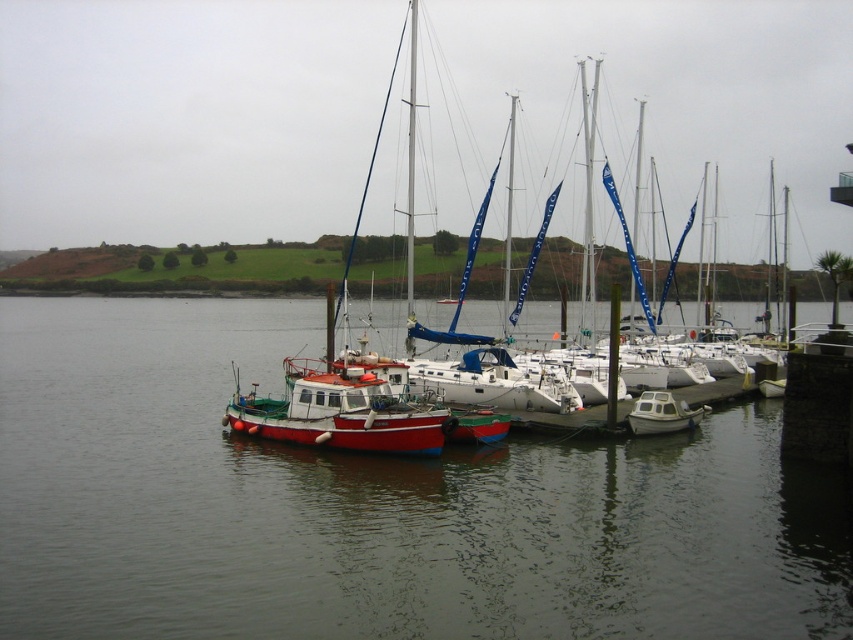
You are a photographer planning to capture a wide shot of the marina. You want to ensure that both the smooth water at center and the red matte fishing boat at center are clearly visible in the frame. Based on their sizes, which object will occupy more of the image area?

The smooth water at center is larger in size than the red matte fishing boat at center, so it will occupy more of the image area.

You are standing at the marina and want to reach a specific point marked at coordinates point (741, 509). If your maximum comfortable walking distance is 15 meters, can you comfortably walk to that point from where you are standing?

The distance of point (741, 509) from camera is 15.75 meters, which exceeds your 15 meter limit. You would need to walk 0.75 meters further than your comfortable range.